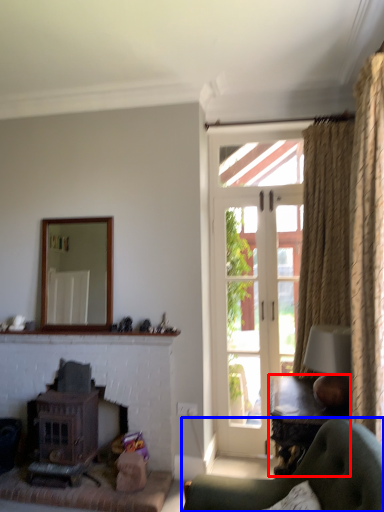
Question: Which point is closer to the camera, table (highlighted by a red box) or chair (highlighted by a blue box)?

Choices:
 (A) table
 (B) chair

Answer: (B)